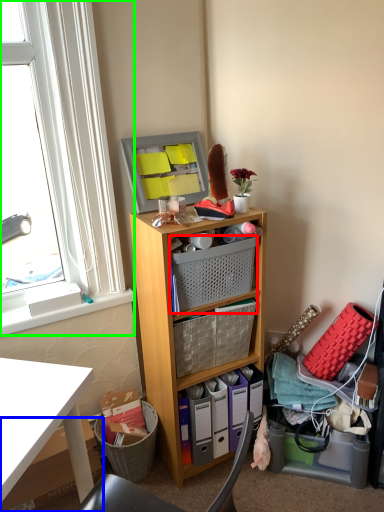
Question: Which object is positioned farthest from basket (highlighted by a red box)? Select from box (highlighted by a blue box) and window (highlighted by a green box).

Choices:
 (A) box
 (B) window

Answer: (A)